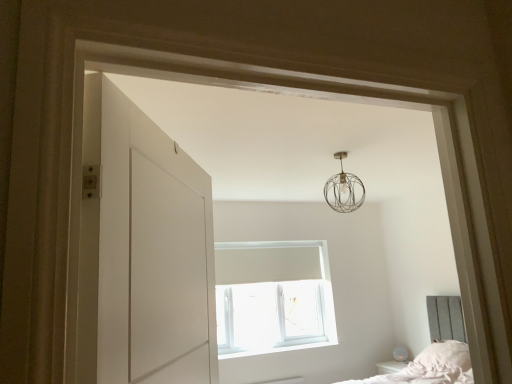
Question: From a real-world perspective, is metallic wire sphere at upper center physically located above or below white plastic window at center?

Choices:
 (A) above
 (B) below

Answer: (A)

Question: Which is correct: metallic wire sphere at upper center is inside white plastic window at center, or outside of it?

Choices:
 (A) inside
 (B) outside

Answer: (B)

Question: Estimate the real-world distances between objects in this image. Which object is farther from the white plastic window at center?

Choices:
 (A) white painted wood at lower center
 (B) metallic wire sphere at upper center

Answer: (B)

Question: Based on their relative distances, which object is farther from the white plastic window at center?

Choices:
 (A) metallic wire sphere at upper center
 (B) white painted wood at lower center

Answer: (A)